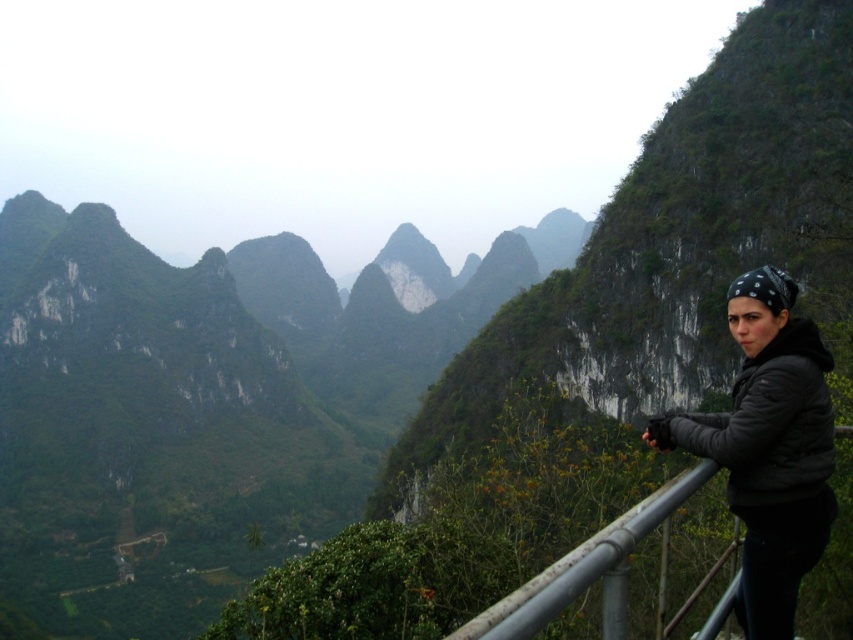
Question: Among these points, which one is farthest from the camera?

Choices:
 (A) (762, 371)
 (B) (503, 600)

Answer: (A)

Question: Among these objects, which one is farthest from the camera?

Choices:
 (A) rusty metal railing at lower right
 (B) black matte jacket at right

Answer: (B)

Question: Can you confirm if black matte jacket at right is positioned to the right of rusty metal railing at lower right?

Choices:
 (A) no
 (B) yes

Answer: (B)

Question: Considering the relative positions of black matte jacket at right and rusty metal railing at lower right in the image provided, where is black matte jacket at right located with respect to rusty metal railing at lower right?

Choices:
 (A) below
 (B) above

Answer: (B)

Question: Can you confirm if black matte jacket at right is bigger than rusty metal railing at lower right?

Choices:
 (A) no
 (B) yes

Answer: (A)